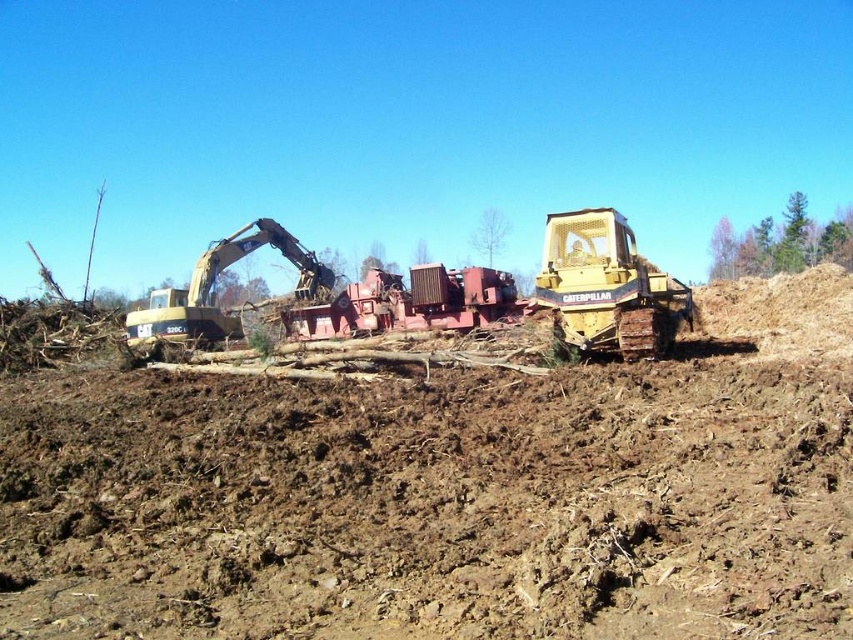
Question: Does red metal tractor at center appear under gold metallic excavator at left?

Choices:
 (A) yes
 (B) no

Answer: (B)

Question: Which object is positioned closest to the red metal tractor at center?

Choices:
 (A) gold metallic excavator at left
 (B) yellow metallic tractor at center

Answer: (A)

Question: Observing the image, what is the correct spatial positioning of yellow metallic tractor at center in reference to gold metallic excavator at left?

Choices:
 (A) left
 (B) right

Answer: (B)

Question: Which of the following is the farthest from the observer?

Choices:
 (A) (543, 554)
 (B) (144, 328)
 (C) (341, 307)
 (D) (575, 285)

Answer: (C)

Question: Is yellow metallic tractor at center wider than gold metallic excavator at left?

Choices:
 (A) yes
 (B) no

Answer: (B)

Question: Which point appears closest to the camera in this image?

Choices:
 (A) (268, 461)
 (B) (686, 316)

Answer: (A)